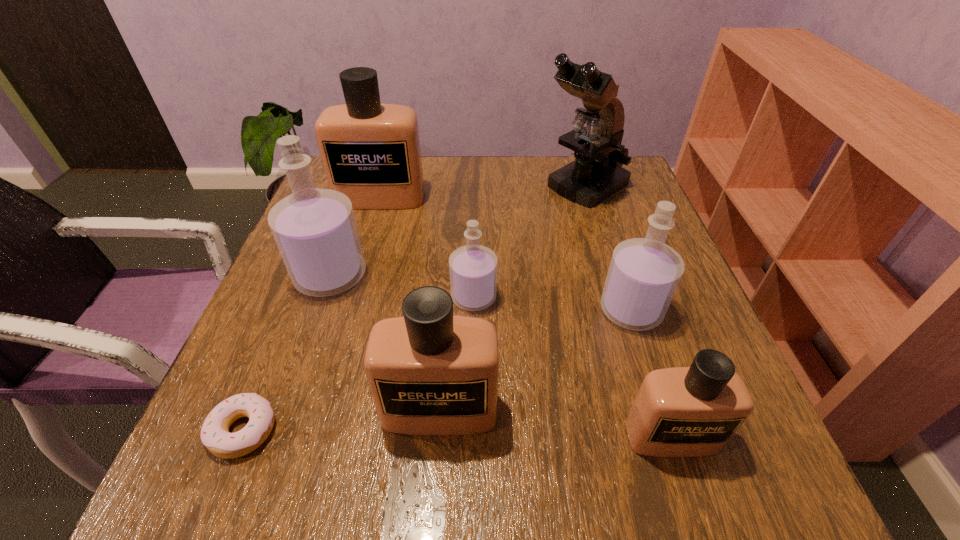
In the image, there is a desktop. Where is `vacant region at the left edge`? This screenshot has width=960, height=540. vacant region at the left edge is located at coordinates (264, 345).

Where is `free region at the right edge of the desktop`? free region at the right edge of the desktop is located at coordinates (614, 242).

Locate an element on the screen. vacant space at the far right corner is located at coordinates (602, 203).

Locate an element on the screen. This screenshot has height=540, width=960. free space between the rightmost beige perfume and the leftmost purple perfume is located at coordinates (x=501, y=356).

The height and width of the screenshot is (540, 960). Identify the location of vacant region between the microscope and the biggest purple perfume. (457, 231).

The image size is (960, 540). Identify the location of vacant space that's between the second purple perfume from left to right and the biggest beige perfume. (427, 247).

The height and width of the screenshot is (540, 960). Identify the location of blank region between the second biggest purple perfume and the second purple perfume from right to left. (552, 303).

Identify the location of unoccupied area between the second purple perfume from right to left and the white doughnut. Image resolution: width=960 pixels, height=540 pixels. (359, 363).

At what (x,y) coordinates should I click in order to perform the action: click on blank region between the rightmost beige perfume and the second purple perfume from left to right. Please return your answer as a coordinate pair (x, y). Looking at the image, I should click on (572, 367).

Identify which object is located as the sixth nearest to the biggest purple perfume. Please provide its 2D coordinates. Your answer should be formatted as a tuple, i.e. [(x, y)], where the tuple contains the x and y coordinates of a point satisfying the conditions above.

[(644, 273)]